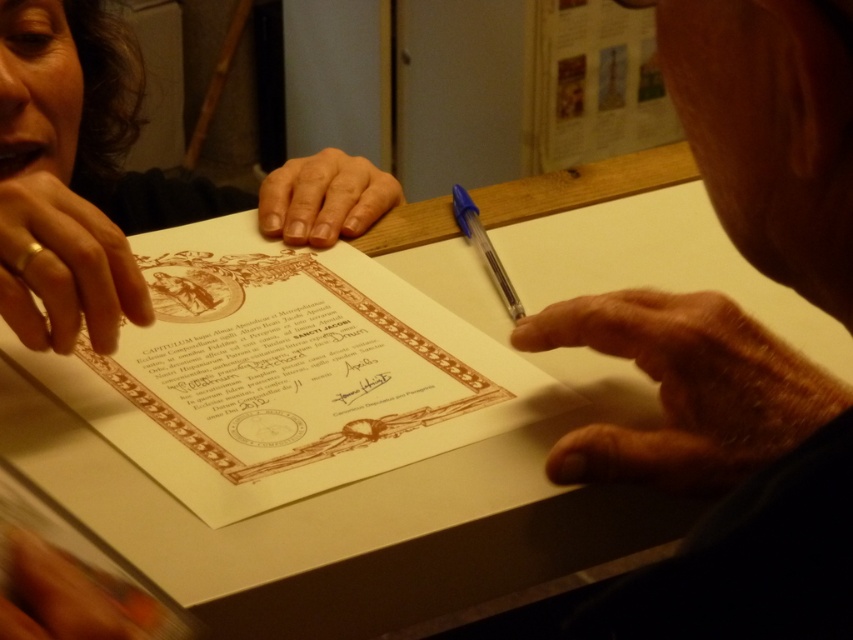
Question: Which of the following is the farthest from the observer?

Choices:
 (A) (363, 180)
 (B) (747, 218)
 (C) (32, 120)

Answer: (A)

Question: Which point is closer to the camera?

Choices:
 (A) (467, 218)
 (B) (795, 436)
 (C) (1, 211)

Answer: (B)

Question: Does smooth skin hand at center appear over blue plastic pen at center?

Choices:
 (A) no
 (B) yes

Answer: (B)

Question: Observing the image, what is the correct spatial positioning of smooth skin hand at upper right in reference to brown paper document at center?

Choices:
 (A) below
 (B) above

Answer: (A)

Question: Estimate the real-world distances between objects in this image. Which object is farther from the gold ring at left?

Choices:
 (A) smooth skin hand at center
 (B) smooth skin hand at upper right

Answer: (B)

Question: Does brown paper document at center appear over gold ring at left?

Choices:
 (A) no
 (B) yes

Answer: (A)